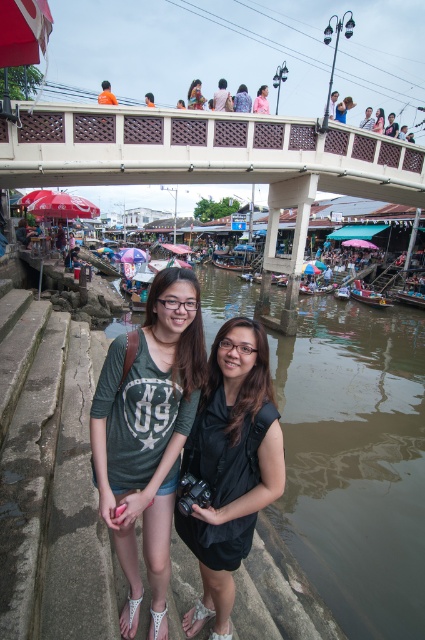
Question: Which of the following is the closest to the observer?

Choices:
 (A) wooden polished boat at lower center
 (B) white concrete bridge at upper center
 (C) green cotton shirt at center
 (D) black matte vest at center

Answer: (C)

Question: Which object appears closest to the camera in this image?

Choices:
 (A) green cotton shirt at center
 (B) white concrete bridge at upper center
 (C) wooden polished boat at lower center
 (D) black matte vest at center

Answer: (A)

Question: Can you confirm if black matte vest at center is positioned above wooden polished boat at lower center?

Choices:
 (A) no
 (B) yes

Answer: (A)

Question: Which object appears closest to the camera in this image?

Choices:
 (A) black matte vest at center
 (B) green cotton shirt at center

Answer: (B)

Question: Does white concrete bridge at upper center have a lesser width compared to wooden polished boat at lower center?

Choices:
 (A) no
 (B) yes

Answer: (A)

Question: Is white concrete bridge at upper center bigger than green cotton shirt at center?

Choices:
 (A) yes
 (B) no

Answer: (A)